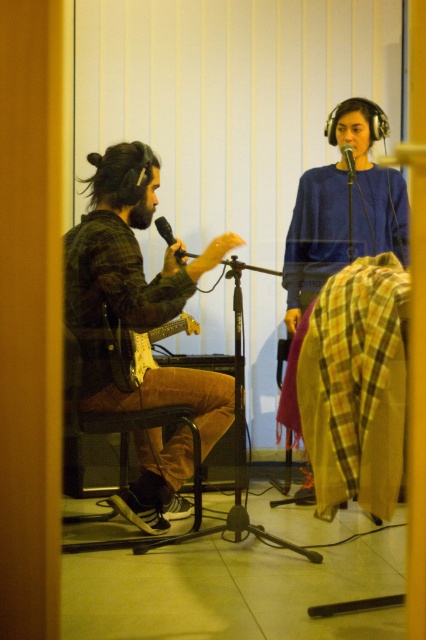
From the picture: Is blue cotton sweater at upper center above brown leather chair at left?

Yes.

Is point (344, 243) less distant than point (134, 371)?

No.

Locate an element on the screen. Image resolution: width=426 pixels, height=640 pixels. blue cotton sweater at upper center is located at coordinates (337, 228).

Identify the location of blue cotton sweater at upper center. (337, 228).

Is blue cotton sweater at upper center positioned at the back of matte black microphone at upper center?

Yes, it is behind matte black microphone at upper center.

Is point (345, 248) closer to camera compared to point (350, 150)?

No, (345, 248) is further to viewer.

In order to click on blue cotton sweater at upper center in this screenshot , I will do `click(337, 228)`.

This screenshot has height=640, width=426. Find the location of `flannel shirt at left`. flannel shirt at left is located at coordinates (135, 292).

Is flannel shirt at left closer to the viewer compared to blue cotton sweater at upper center?

Yes.

Which is behind, point (189, 372) or point (374, 109)?

Positioned behind is point (374, 109).

Image resolution: width=426 pixels, height=640 pixels. What are the coordinates of `flannel shirt at left` in the screenshot? It's located at (135, 292).